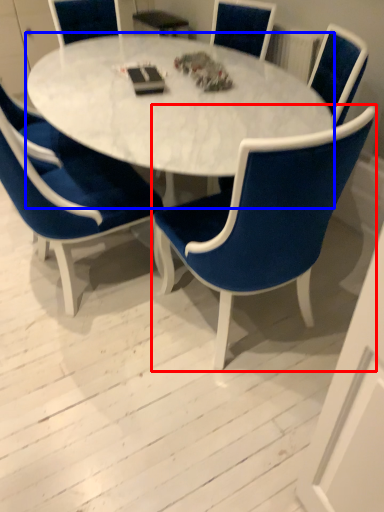
Question: Which object is closer to the camera taking this photo, chair (highlighted by a red box) or coffee table (highlighted by a blue box)?

Choices:
 (A) chair
 (B) coffee table

Answer: (A)